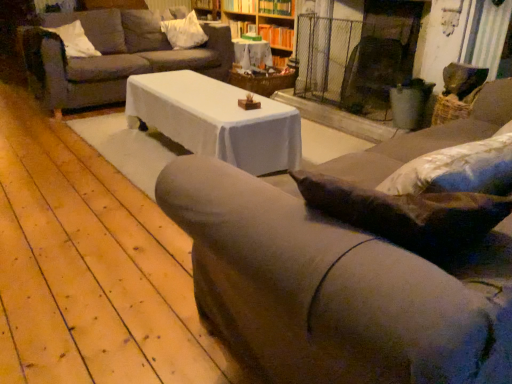
Question: Does wooden textured table at center have a lesser width compared to velvet brown couch at center, the first studio couch when ordered from right to left?

Choices:
 (A) no
 (B) yes

Answer: (B)

Question: From the image's perspective, is wooden textured table at center on velvet brown couch at center, the second studio couch when ordered from top to bottom?

Choices:
 (A) no
 (B) yes

Answer: (B)

Question: Is wooden textured table at center at the left side of velvet brown couch at center, positioned as the first studio couch in front-to-back order?

Choices:
 (A) yes
 (B) no

Answer: (A)

Question: Does wooden textured table at center have a greater height compared to velvet brown couch at center, the second studio couch when ordered from top to bottom?

Choices:
 (A) no
 (B) yes

Answer: (A)

Question: Is wooden textured table at center not near velvet brown couch at center, positioned as the first studio couch in front-to-back order?

Choices:
 (A) yes
 (B) no

Answer: (A)

Question: Based on their positions, is dark brown leather swivel chair at center located to the left or right of wooden bookshelf at upper center?

Choices:
 (A) left
 (B) right

Answer: (B)

Question: Is point (364, 74) positioned closer to the camera than point (257, 8)?

Choices:
 (A) closer
 (B) farther

Answer: (A)

Question: From their relative heights in the image, would you say dark brown leather swivel chair at center is taller or shorter than wooden bookshelf at upper center?

Choices:
 (A) tall
 (B) short

Answer: (B)

Question: Is dark brown leather swivel chair at center in front of or behind wooden bookshelf at upper center in the image?

Choices:
 (A) behind
 (B) front

Answer: (B)

Question: In terms of width, does wooden bookshelf at upper center, marked as the first shelf in a top-to-bottom arrangement, look wider or thinner when compared to white soft pillow at upper left, acting as the 1th pillow starting from the front?

Choices:
 (A) thin
 (B) wide

Answer: (A)

Question: Is wooden bookshelf at upper center, marked as the first shelf in a top-to-bottom arrangement, bigger or smaller than white soft pillow at upper left, acting as the 1th pillow starting from the front?

Choices:
 (A) small
 (B) big

Answer: (A)

Question: From the image's perspective, is wooden bookshelf at upper center, the second shelf ordered from the bottom, positioned above or below white soft pillow at upper left, positioned as the first pillow in left-to-right order?

Choices:
 (A) above
 (B) below

Answer: (A)

Question: From a real-world perspective, is wooden bookshelf at upper center, the second shelf ordered from the bottom, above or below white soft pillow at upper left, acting as the 1th pillow starting from the front?

Choices:
 (A) below
 (B) above

Answer: (B)

Question: Considering the positions of point (287, 46) and point (271, 28), is point (287, 46) closer or farther from the camera than point (271, 28)?

Choices:
 (A) closer
 (B) farther

Answer: (A)

Question: Looking at the image, does wooden bookshelf at upper center seem bigger or smaller compared to wooden bookshelf at upper center, marked as the second shelf in a top-to-bottom arrangement?

Choices:
 (A) small
 (B) big

Answer: (B)